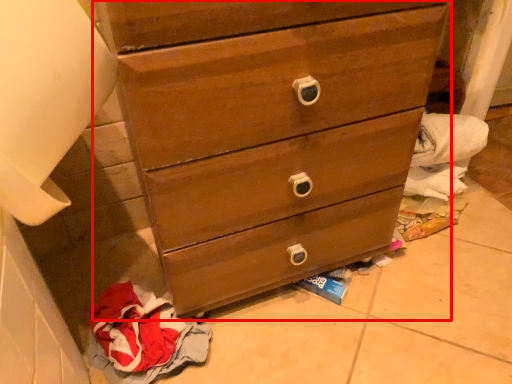
Question: In this image, where is chest of drawers (annotated by the red box) located relative to baby clothe?

Choices:
 (A) left
 (B) right

Answer: (B)